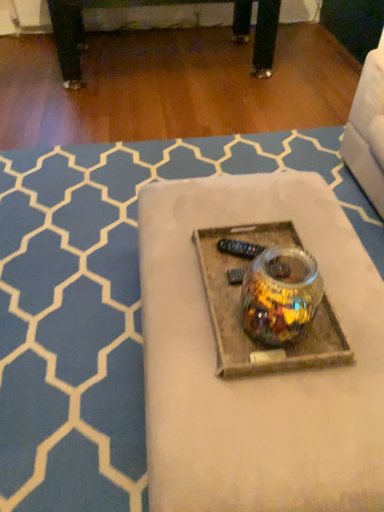
Question: Should I look upward or downward to see translucent glass jar at center?

Choices:
 (A) up
 (B) down

Answer: (B)

Question: From the image's perspective, is translucent glass jar at center located above translucent glass jar at center?

Choices:
 (A) yes
 (B) no

Answer: (B)

Question: From a real-world perspective, does translucent glass jar at center stand above translucent glass jar at center?

Choices:
 (A) no
 (B) yes

Answer: (B)

Question: Are translucent glass jar at center and translucent glass jar at center making contact?

Choices:
 (A) yes
 (B) no

Answer: (B)

Question: Is translucent glass jar at center smaller than translucent glass jar at center?

Choices:
 (A) no
 (B) yes

Answer: (B)

Question: Is translucent glass jar at center at the back of translucent glass jar at center?

Choices:
 (A) yes
 (B) no

Answer: (B)

Question: Is translucent glass jar at center in front of translucent glass jar at center?

Choices:
 (A) no
 (B) yes

Answer: (B)

Question: Is translucent glass jar at center to the right of translucent glass jar at center from the viewer's perspective?

Choices:
 (A) yes
 (B) no

Answer: (B)

Question: From the image's perspective, is translucent glass jar at center on top of translucent glass jar at center?

Choices:
 (A) yes
 (B) no

Answer: (A)

Question: Is translucent glass jar at center closer to camera compared to translucent glass jar at center?

Choices:
 (A) yes
 (B) no

Answer: (B)

Question: Is translucent glass jar at center taller than translucent glass jar at center?

Choices:
 (A) no
 (B) yes

Answer: (A)

Question: Is translucent glass jar at center thinner than translucent glass jar at center?

Choices:
 (A) yes
 (B) no

Answer: (B)

Question: From a real-world perspective, is translucent glass jar at center physically above translucent glass jar at center?

Choices:
 (A) yes
 (B) no

Answer: (B)

Question: In terms of size, does translucent glass jar at center appear bigger or smaller than translucent glass jar at center?

Choices:
 (A) small
 (B) big

Answer: (B)